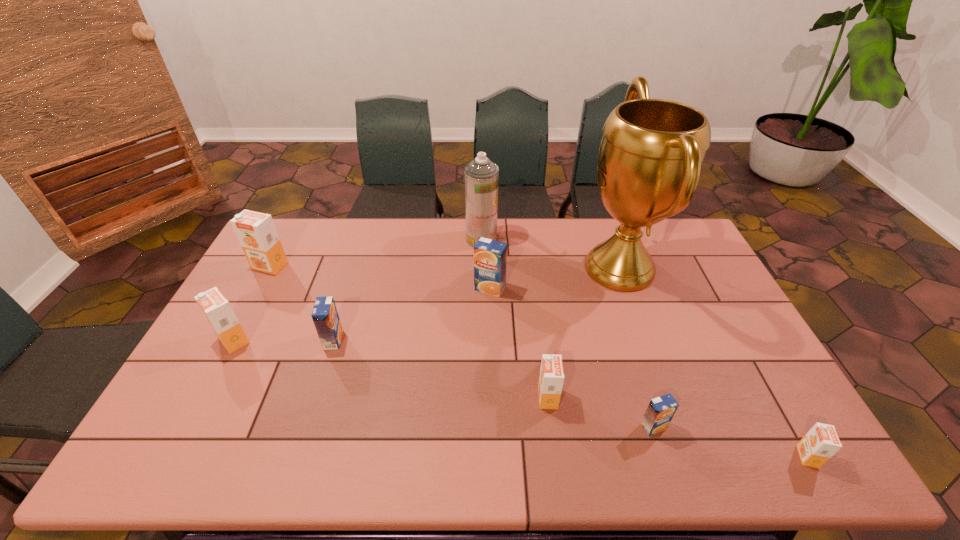
The height and width of the screenshot is (540, 960). I want to click on the sixth object from left to right, so click(x=551, y=378).

Find the location of a particular element. the third orange juice from right to left is located at coordinates (551, 378).

What are the coordinates of `the nearest blue orange_juice` in the screenshot? It's located at (660, 411).

Where is `the second nearest orange juice`? This screenshot has width=960, height=540. the second nearest orange juice is located at coordinates (660, 411).

At what (x,y) coordinates should I click in order to perform the action: click on the rightmost orange juice. Please return your answer as a coordinate pair (x, y). The image size is (960, 540). Looking at the image, I should click on (821, 442).

Where is `the nearest object`? the nearest object is located at coordinates (821, 442).

Where is `free space located 0.150m on the surface of the gold trophy cup with symbols`? The image size is (960, 540). free space located 0.150m on the surface of the gold trophy cup with symbols is located at coordinates (536, 268).

Where is `free location located 0.090m on the surface of the gold trophy cup with symbols`? Image resolution: width=960 pixels, height=540 pixels. free location located 0.090m on the surface of the gold trophy cup with symbols is located at coordinates (552, 268).

I want to click on vacant area situated 0.130m on the surface of the gold trophy cup with symbols, so click(541, 268).

Image resolution: width=960 pixels, height=540 pixels. What are the coordinates of `free location located on the front of the aerosol can` in the screenshot? It's located at click(482, 296).